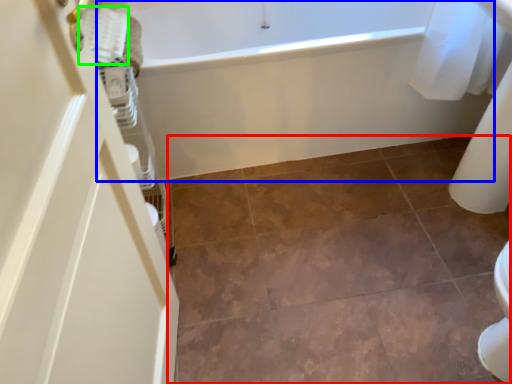
Question: Which object is positioned farthest from ceramic tile (highlighted by a red box)? Select from bathtub (highlighted by a blue box) and material (highlighted by a green box).

Choices:
 (A) bathtub
 (B) material

Answer: (B)